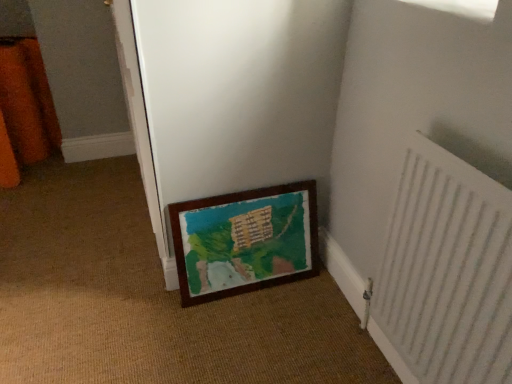
Question: From the image's perspective, is wooden frame at lower center beneath wooden frame at lower center?

Choices:
 (A) no
 (B) yes

Answer: (A)

Question: From a real-world perspective, does wooden frame at lower center stand above wooden frame at lower center?

Choices:
 (A) no
 (B) yes

Answer: (B)

Question: Is wooden frame at lower center positioned before wooden frame at lower center?

Choices:
 (A) no
 (B) yes

Answer: (B)

Question: Are wooden frame at lower center and wooden frame at lower center making contact?

Choices:
 (A) yes
 (B) no

Answer: (B)

Question: Is wooden frame at lower center outside of wooden frame at lower center?

Choices:
 (A) no
 (B) yes

Answer: (B)

Question: Is wooden frame at lower center to the right of wooden frame at lower center from the viewer's perspective?

Choices:
 (A) no
 (B) yes

Answer: (A)

Question: Is wooden frame at lower center closer to the viewer compared to wooden frame at lower center?

Choices:
 (A) yes
 (B) no

Answer: (B)

Question: Is wooden frame at lower center next to wooden frame at lower center?

Choices:
 (A) yes
 (B) no

Answer: (B)

Question: Does wooden frame at lower center have a greater height compared to wooden frame at lower center?

Choices:
 (A) no
 (B) yes

Answer: (A)

Question: Is wooden frame at lower center looking in the opposite direction of wooden frame at lower center?

Choices:
 (A) no
 (B) yes

Answer: (B)

Question: Is there a large distance between wooden frame at lower center and wooden frame at lower center?

Choices:
 (A) no
 (B) yes

Answer: (A)

Question: Is wooden frame at lower center wider than wooden frame at lower center?

Choices:
 (A) no
 (B) yes

Answer: (A)

Question: Can you confirm if wooden frame at lower center is shorter than white textured radiator at lower right?

Choices:
 (A) no
 (B) yes

Answer: (B)